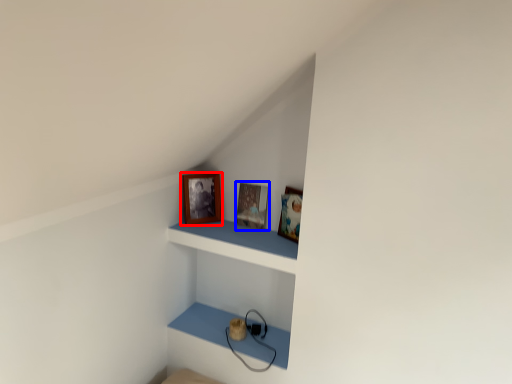
Question: Which point is closer to the camera, picture frame (highlighted by a red box) or picture frame (highlighted by a blue box)?

Choices:
 (A) picture frame
 (B) picture frame

Answer: (A)